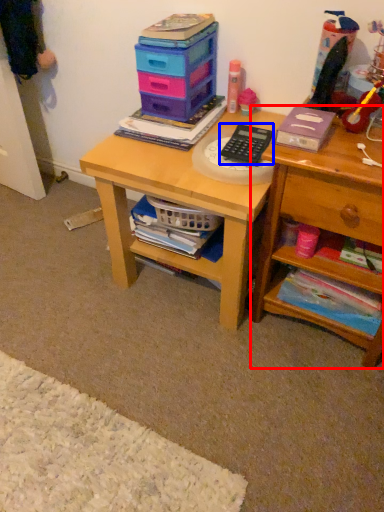
Question: Which object is further to the camera taking this photo, shelf (highlighted by a red box) or calculator (highlighted by a blue box)?

Choices:
 (A) shelf
 (B) calculator

Answer: (B)